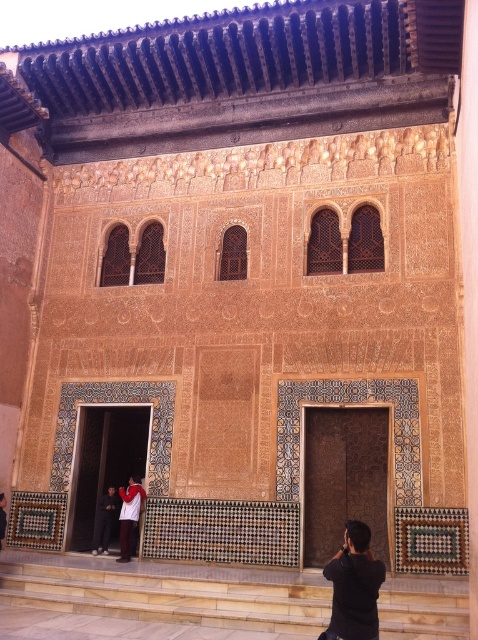
You are standing in front of the building and want to take a photo of both the light beige stone stairs at lower center and the dark gray fabric pants at lower left. Which object should you focus on first to ensure both are in clear view?

You should focus on the light beige stone stairs at lower center first because it is closer to you than the dark gray fabric pants at lower left, so adjusting focus from near to far will help both be in clear view.